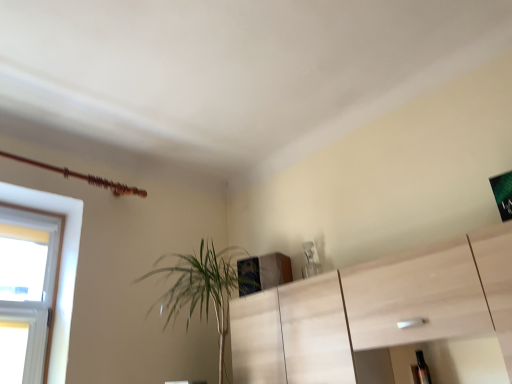
Question: In the image, is transparent plastic bottle at lower right positioned in front of or behind green leafy plant at center-left?

Choices:
 (A) behind
 (B) front

Answer: (A)

Question: Is transparent plastic bottle at lower right wider or thinner than green leafy plant at center-left?

Choices:
 (A) wide
 (B) thin

Answer: (B)

Question: Does point (420, 352) appear closer or farther from the camera than point (186, 269)?

Choices:
 (A) closer
 (B) farther

Answer: (A)

Question: Looking at their shapes, would you say green leafy plant at center-left is wider or thinner than transparent plastic bottle at lower right?

Choices:
 (A) wide
 (B) thin

Answer: (A)

Question: Would you say green leafy plant at center-left is inside or outside transparent plastic bottle at lower right?

Choices:
 (A) outside
 (B) inside

Answer: (A)

Question: Would you say green leafy plant at center-left is to the left or to the right of transparent plastic bottle at lower right in the picture?

Choices:
 (A) right
 (B) left

Answer: (B)

Question: Looking at the image, does green leafy plant at center-left seem bigger or smaller compared to transparent plastic bottle at lower right?

Choices:
 (A) big
 (B) small

Answer: (A)